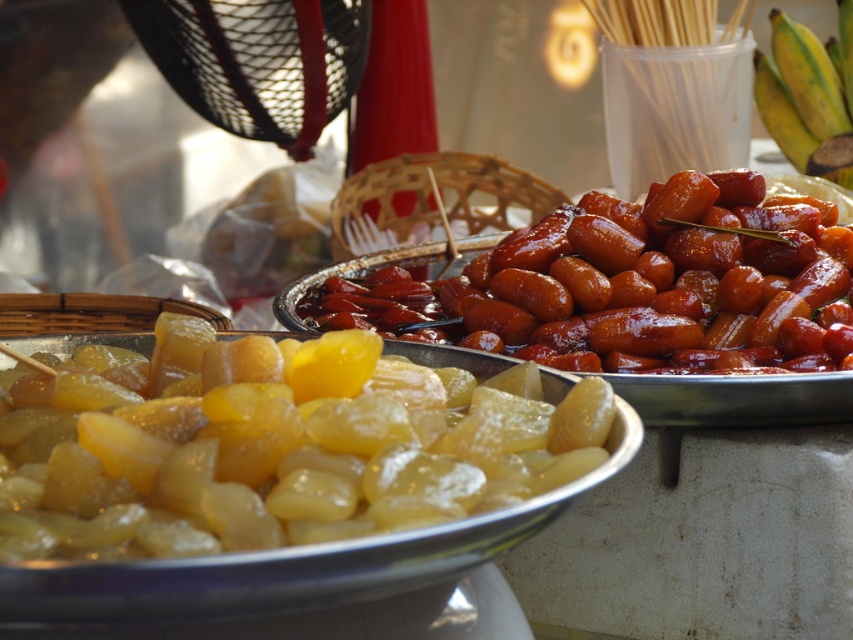
Question: Which of the following is the farthest from the observer?

Choices:
 (A) (276, 397)
 (B) (604, 289)

Answer: (B)

Question: Does translucent yellow gummy at center have a smaller size compared to shiny brown sausages at center?

Choices:
 (A) no
 (B) yes

Answer: (B)

Question: Among these objects, which one is nearest to the camera?

Choices:
 (A) translucent yellow gummy at center
 (B) shiny brown sausages at center

Answer: (A)

Question: Is translucent yellow gummy at center positioned at the back of shiny brown sausages at center?

Choices:
 (A) yes
 (B) no

Answer: (B)

Question: Which point is closer to the camera?

Choices:
 (A) (350, 390)
 (B) (814, 208)

Answer: (A)

Question: Is translucent yellow gummy at center smaller than shiny brown sausages at center?

Choices:
 (A) no
 (B) yes

Answer: (B)